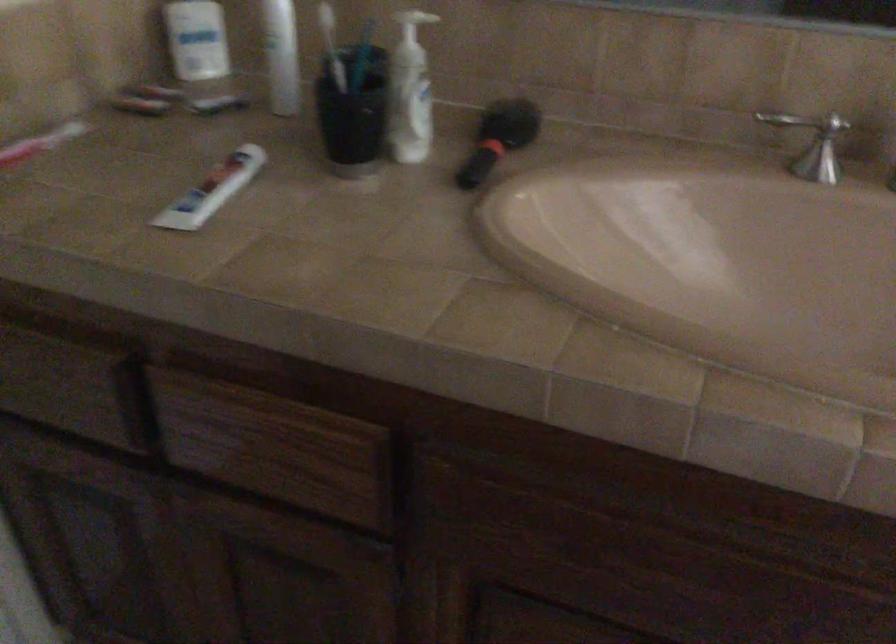
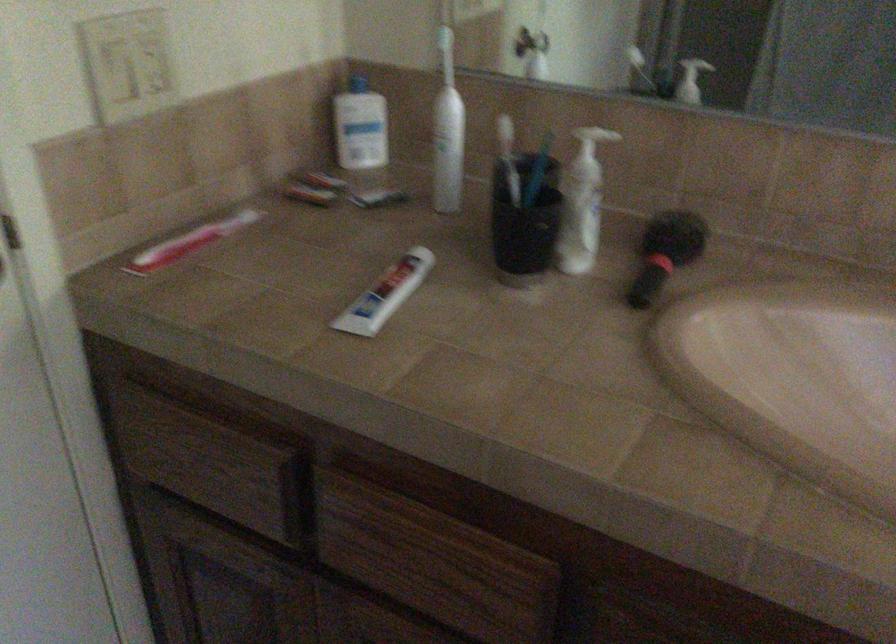
Locate, in the second image, the point that corresponds to the point at 254,450 in the first image.

(410, 560)